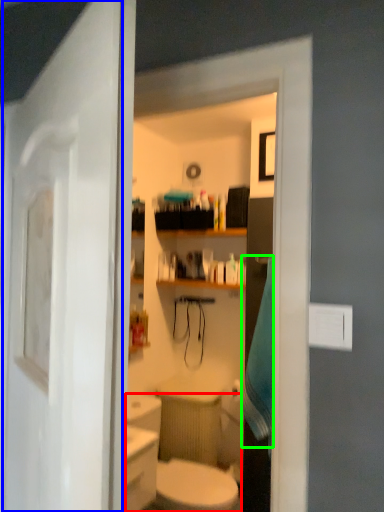
Question: Estimate the real-world distances between objects in this image. Which object is closer to sink (highlighted by a red box), door (highlighted by a blue box) or bath towel (highlighted by a green box)?

Choices:
 (A) door
 (B) bath towel

Answer: (B)